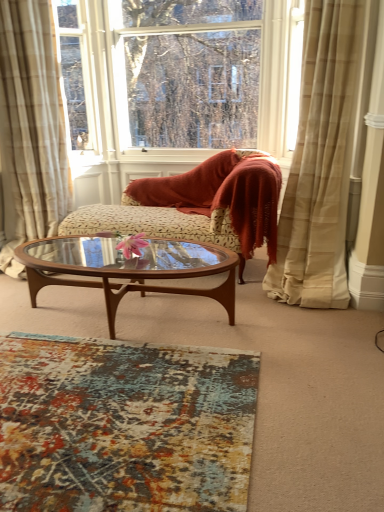
What do you see at coordinates (320, 162) in the screenshot?
I see `beige plaid curtain at right, marked as the second curtain in a left-to-right arrangement` at bounding box center [320, 162].

At what (x,y) coordinates should I click in order to perform the action: click on beige plaid curtain at left, positioned as the 1th curtain in left-to-right order. Please return your answer as a coordinate pair (x, y). This screenshot has height=512, width=384. Looking at the image, I should click on (32, 124).

Which of these two, textured multicolored rug at lower left or beige plaid curtain at right, marked as the second curtain in a left-to-right arrangement, is bigger?

With larger size is beige plaid curtain at right, marked as the second curtain in a left-to-right arrangement.

Is textured multicolored rug at lower left next to beige plaid curtain at right, marked as the second curtain in a left-to-right arrangement, and touching it?

No, textured multicolored rug at lower left is not next to beige plaid curtain at right, marked as the second curtain in a left-to-right arrangement.

Which point is more forward, (120, 486) or (267, 271)?

The point (120, 486) is in front.

Could you tell me if velvet beige chaise at center is turned towards beige plaid curtain at left, positioned as the 1th curtain in left-to-right order?

No, velvet beige chaise at center is not turned towards beige plaid curtain at left, positioned as the 1th curtain in left-to-right order.

Considering the sizes of objects velvet beige chaise at center and beige plaid curtain at left, positioned as the 1th curtain in left-to-right order, in the image provided, who is bigger, velvet beige chaise at center or beige plaid curtain at left, positioned as the 1th curtain in left-to-right order,?

With larger size is velvet beige chaise at center.

Could you measure the distance between velvet beige chaise at center and beige plaid curtain at left, the 2th curtain when ordered from right to left?

velvet beige chaise at center is 34.08 inches away from beige plaid curtain at left, the 2th curtain when ordered from right to left.

You are a GUI agent. You are given a task and a screenshot of the screen. Output one action in this format:
    pyautogui.click(x=<x>, y=<y>)
    Task: Click on the curtain on the left of velvet beige chaise at center
    The image size is (384, 512).
    Given the screenshot: What is the action you would take?
    pyautogui.click(x=32, y=124)

From a real-world perspective, who is located lower, beige plaid curtain at right, which appears as the 1th curtain when viewed from the right, or beige plaid curtain at left, positioned as the 1th curtain in left-to-right order?

beige plaid curtain at left, positioned as the 1th curtain in left-to-right order, is physically lower.

Based on the photo, between beige plaid curtain at right, which appears as the 1th curtain when viewed from the right, and beige plaid curtain at left, the 2th curtain when ordered from right to left, which one has smaller size?

With smaller size is beige plaid curtain at right, which appears as the 1th curtain when viewed from the right.

Is beige plaid curtain at right, which appears as the 1th curtain when viewed from the right, facing away from beige plaid curtain at left, the 2th curtain when ordered from right to left?

No, beige plaid curtain at left, the 2th curtain when ordered from right to left, is not at the back of beige plaid curtain at right, which appears as the 1th curtain when viewed from the right.

Between beige plaid curtain at right, marked as the second curtain in a left-to-right arrangement, and beige plaid curtain at left, the 2th curtain when ordered from right to left, which one appears on the left side from the viewer's perspective?

Positioned to the left is beige plaid curtain at left, the 2th curtain when ordered from right to left.

Is brown wood/glass coffee table at center behind velvet beige chaise at center?

That is False.

Considering the sizes of objects brown wood/glass coffee table at center and velvet beige chaise at center in the image provided, who is bigger, brown wood/glass coffee table at center or velvet beige chaise at center?

Bigger between the two is velvet beige chaise at center.

From the image's perspective, is brown wood/glass coffee table at center below velvet beige chaise at center?

Yes, from the image's perspective, brown wood/glass coffee table at center is below velvet beige chaise at center.

Is brown wood/glass coffee table at center inside the boundaries of velvet beige chaise at center, or outside?

brown wood/glass coffee table at center exists outside the volume of velvet beige chaise at center.

Choose the correct answer: Is beige plaid curtain at right, marked as the second curtain in a left-to-right arrangement, inside textured multicolored rug at lower left or outside it?

beige plaid curtain at right, marked as the second curtain in a left-to-right arrangement, exists outside the volume of textured multicolored rug at lower left.

Considering the relative positions of beige plaid curtain at right, marked as the second curtain in a left-to-right arrangement, and textured multicolored rug at lower left in the image provided, is beige plaid curtain at right, marked as the second curtain in a left-to-right arrangement, to the right of textured multicolored rug at lower left from the viewer's perspective?

Yes.

In the scene shown: In terms of width, does beige plaid curtain at right, marked as the second curtain in a left-to-right arrangement, look wider or thinner when compared to textured multicolored rug at lower left?

Clearly, beige plaid curtain at right, marked as the second curtain in a left-to-right arrangement, has less width compared to textured multicolored rug at lower left.

In terms of size, does beige plaid curtain at right, which appears as the 1th curtain when viewed from the right, appear bigger or smaller than textured multicolored rug at lower left?

In the image, beige plaid curtain at right, which appears as the 1th curtain when viewed from the right, appears to be larger than textured multicolored rug at lower left.

This screenshot has width=384, height=512. What are the coordinates of `plain on the left of transparent glass window at upper center` in the screenshot? It's located at (124, 425).

Which object is thinner, transparent glass window at upper center or textured multicolored rug at lower left?

Thinner between the two is transparent glass window at upper center.

Is transparent glass window at upper center far from textured multicolored rug at lower left?

Yes, transparent glass window at upper center is far from textured multicolored rug at lower left.

From the image's perspective, between transparent glass window at upper center and textured multicolored rug at lower left, which one is located above?

transparent glass window at upper center is shown above in the image.

From a real-world perspective, which object stands above the other?

From a 3D spatial view, transparent glass window at upper center is above.

I want to click on window that appears behind the beige plaid curtain at left, the 2th curtain when ordered from right to left, so click(178, 79).

Does beige plaid curtain at left, the 2th curtain when ordered from right to left, appear on the left side of transparent glass window at upper center?

Correct, you'll find beige plaid curtain at left, the 2th curtain when ordered from right to left, to the left of transparent glass window at upper center.

Where is `plain that appears in front of the beige plaid curtain at right, marked as the second curtain in a left-to-right arrangement`? This screenshot has width=384, height=512. plain that appears in front of the beige plaid curtain at right, marked as the second curtain in a left-to-right arrangement is located at coordinates (124, 425).

From a real-world perspective, starting from the velvet beige chaise at center, which curtain is the 1st one vertically above it? Please provide its 2D coordinates.

[(32, 124)]

Which object lies further to the anchor point brown wood/glass coffee table at center, transparent glass window at upper center or beige plaid curtain at right, marked as the second curtain in a left-to-right arrangement?

transparent glass window at upper center is further to brown wood/glass coffee table at center.

Looking at the image, which one is located further to textured multicolored rug at lower left, beige plaid curtain at right, marked as the second curtain in a left-to-right arrangement, or transparent glass window at upper center?

transparent glass window at upper center.

Based on the photo, which object lies nearer to the anchor point velvet beige chaise at center, beige plaid curtain at left, positioned as the 1th curtain in left-to-right order, or transparent glass window at upper center?

transparent glass window at upper center is closer to velvet beige chaise at center.

Based on the photo, based on their spatial positions, is transparent glass window at upper center or textured multicolored rug at lower left closer to beige plaid curtain at right, marked as the second curtain in a left-to-right arrangement?

transparent glass window at upper center is positioned closer to the anchor beige plaid curtain at right, marked as the second curtain in a left-to-right arrangement.

Based on their spatial positions, is beige plaid curtain at right, which appears as the 1th curtain when viewed from the right, or velvet beige chaise at center further from brown wood/glass coffee table at center?

beige plaid curtain at right, which appears as the 1th curtain when viewed from the right, is positioned further to the anchor brown wood/glass coffee table at center.

From the image, which object appears to be nearer to beige plaid curtain at right, marked as the second curtain in a left-to-right arrangement, velvet beige chaise at center or beige plaid curtain at left, positioned as the 1th curtain in left-to-right order?

velvet beige chaise at center is positioned closer to the anchor beige plaid curtain at right, marked as the second curtain in a left-to-right arrangement.

From the image, which object appears to be farther from beige plaid curtain at right, which appears as the 1th curtain when viewed from the right, textured multicolored rug at lower left or brown wood/glass coffee table at center?

textured multicolored rug at lower left lies further to beige plaid curtain at right, which appears as the 1th curtain when viewed from the right, than the other object.

Based on their spatial positions, is brown wood/glass coffee table at center or textured multicolored rug at lower left further from transparent glass window at upper center?

textured multicolored rug at lower left lies further to transparent glass window at upper center than the other object.

This screenshot has height=512, width=384. I want to click on coffee table located between textured multicolored rug at lower left and beige plaid curtain at right, which appears as the 1th curtain when viewed from the right, in the left-right direction, so click(127, 268).

Identify the location of coffee table between transparent glass window at upper center and textured multicolored rug at lower left from top to bottom. (127, 268).

Where is `studio couch between beige plaid curtain at left, the 2th curtain when ordered from right to left, and transparent glass window at upper center`? The height and width of the screenshot is (512, 384). studio couch between beige plaid curtain at left, the 2th curtain when ordered from right to left, and transparent glass window at upper center is located at coordinates point(198,205).

Locate an element on the screen. studio couch situated between brown wood/glass coffee table at center and beige plaid curtain at right, which appears as the 1th curtain when viewed from the right, from left to right is located at coordinates (198, 205).